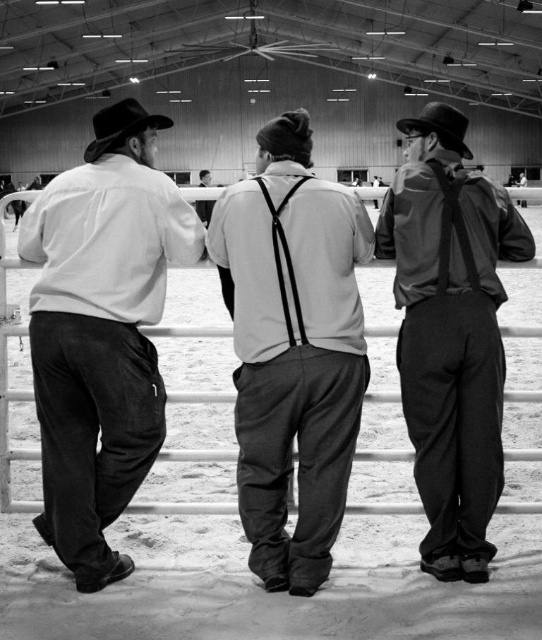
Question: Which point is farther to the camera?

Choices:
 (A) black felt cowboy hat at upper right
 (B) light gray cotton shirt at center

Answer: (A)

Question: Is matte black suspenders at center to the left of rustic leather cowboy hat at center from the viewer's perspective?

Choices:
 (A) yes
 (B) no

Answer: (B)

Question: Does rustic leather cowboy hat at center have a greater width compared to black felt cowboy hat at upper right?

Choices:
 (A) yes
 (B) no

Answer: (A)

Question: Where is light gray cotton shirt at center located in relation to black felt cowboy hat at upper right in the image?

Choices:
 (A) right
 (B) left

Answer: (B)

Question: Which point is farther from the camera taking this photo?

Choices:
 (A) (94, 349)
 (B) (254, 310)

Answer: (B)

Question: Which point is farther to the camera?

Choices:
 (A) matte black suspenders at center
 (B) matte white shirt at left
 (C) light gray cotton shirt at center
 (D) black felt cowboy hat at upper right

Answer: (A)